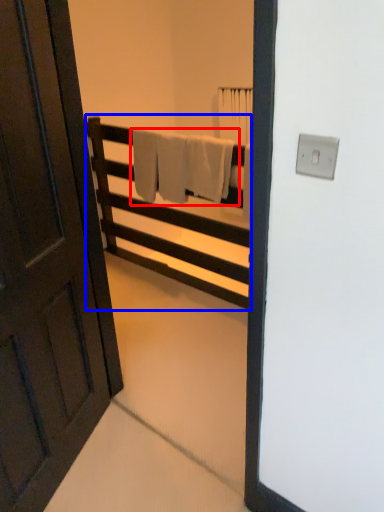
Question: Which object is further to the camera taking this photo, bath towel (highlighted by a red box) or furniture (highlighted by a blue box)?

Choices:
 (A) bath towel
 (B) furniture

Answer: (A)